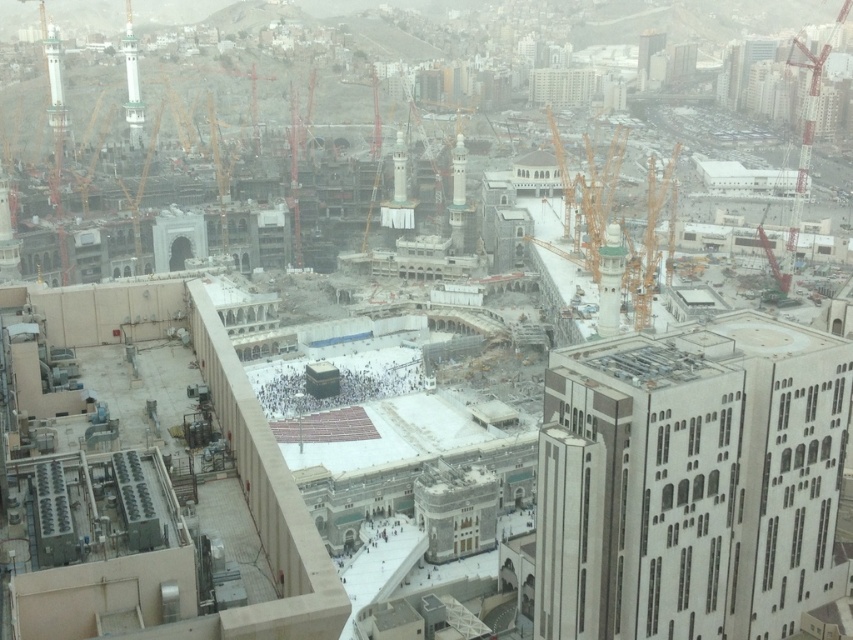
Who is positioned more to the right, metallic yellow crane at center or red metal crane at right?

Positioned to the right is red metal crane at right.

Who is higher up, metallic yellow crane at center or red metal crane at right?

Positioned higher is red metal crane at right.

Is point (573, 220) positioned after point (808, 134)?

No.

Locate an element on the screen. Image resolution: width=853 pixels, height=640 pixels. metallic yellow crane at center is located at coordinates (587, 196).